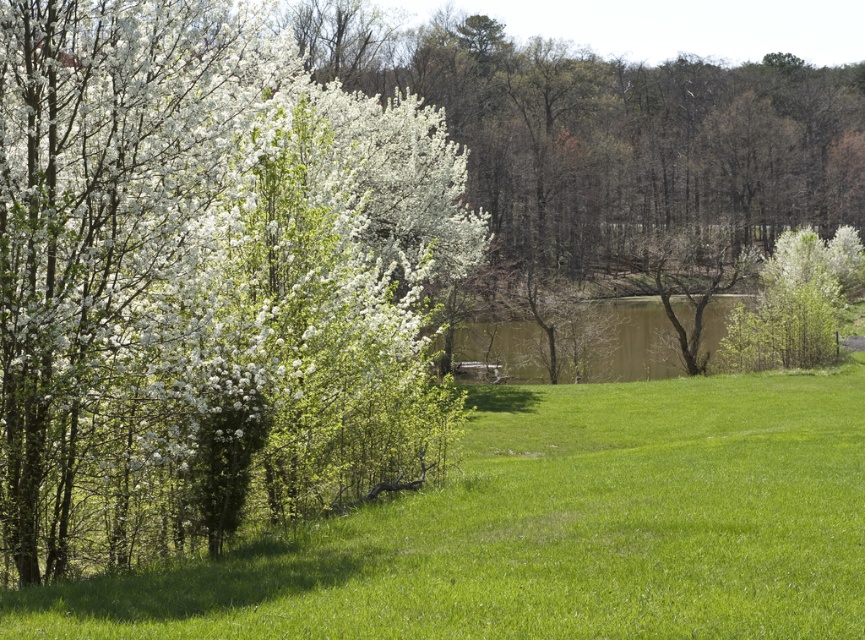
Question: Is white matte flowers at left bigger than green grassy at left?

Choices:
 (A) yes
 (B) no

Answer: (A)

Question: Which object is positioned closest to the brown matte lake at center?

Choices:
 (A) white matte flowers at left
 (B) green grassy at left

Answer: (A)

Question: Which object is the farthest from the green grassy at left?

Choices:
 (A) white matte flowers at left
 (B) brown matte lake at center

Answer: (B)

Question: Is white matte flowers at left positioned at the back of brown matte lake at center?

Choices:
 (A) no
 (B) yes

Answer: (A)

Question: Does white matte flowers at left have a larger size compared to green grassy at left?

Choices:
 (A) yes
 (B) no

Answer: (A)

Question: Which point is farther from the camera taking this photo?

Choices:
 (A) (610, 344)
 (B) (798, 516)
 (C) (125, 524)

Answer: (A)